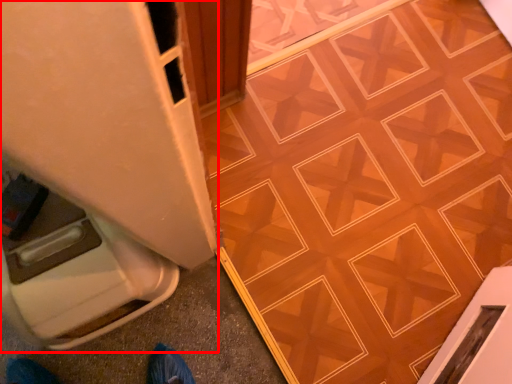
Question: Observing the image, what is the correct spatial positioning of appliance (annotated by the red box) in reference to ceramic tile?

Choices:
 (A) left
 (B) right

Answer: (A)